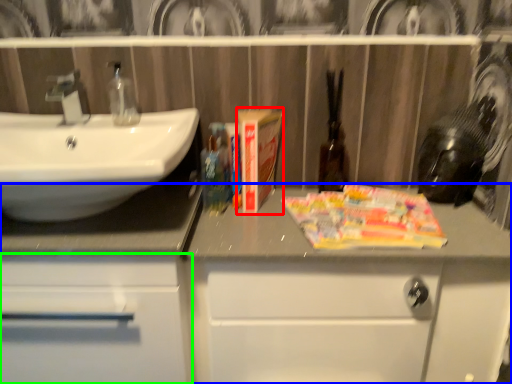
Question: Considering the real-world distances, which object is farthest from paperback book (highlighted by a red box)? bathroom cabinet (highlighted by a blue box) or bathroom cabinet (highlighted by a green box)?

Choices:
 (A) bathroom cabinet
 (B) bathroom cabinet

Answer: (B)